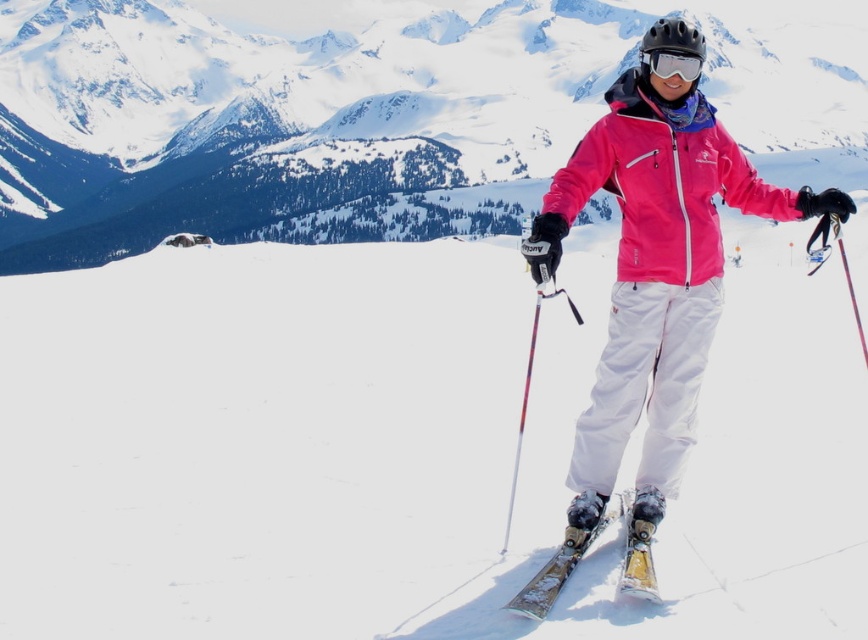
You are a photographer positioned at the base of the mountain, aiming to capture a clear shot of both the pink matte jacket at center and the transparent plastic goggles at center. Considering their distances from you, will both subjects be in focus simultaneously?

The pink matte jacket at center is 14.44 meters away from transparent plastic goggles at center. Since both are at different distances from the photographer, it is unlikely they will both be in focus simultaneously without adjusting the camera settings for a deeper depth of field.

You are standing at the point marked as point (702, 170) and want to ski down to the base of the mountain. If the slope from your current position to the base is 300 feet long, will you reach the base before the slope ends?

The distance between point (702, 170) and the viewer is 286.19 feet, which is less than the 300 feet slope length. Therefore, you will reach the base before the slope ends.